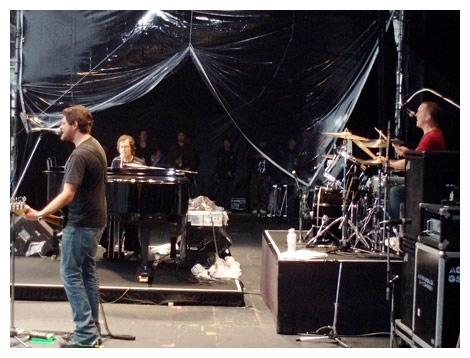
Identify the location of plastic tapestry. The image size is (470, 358). (271, 50).